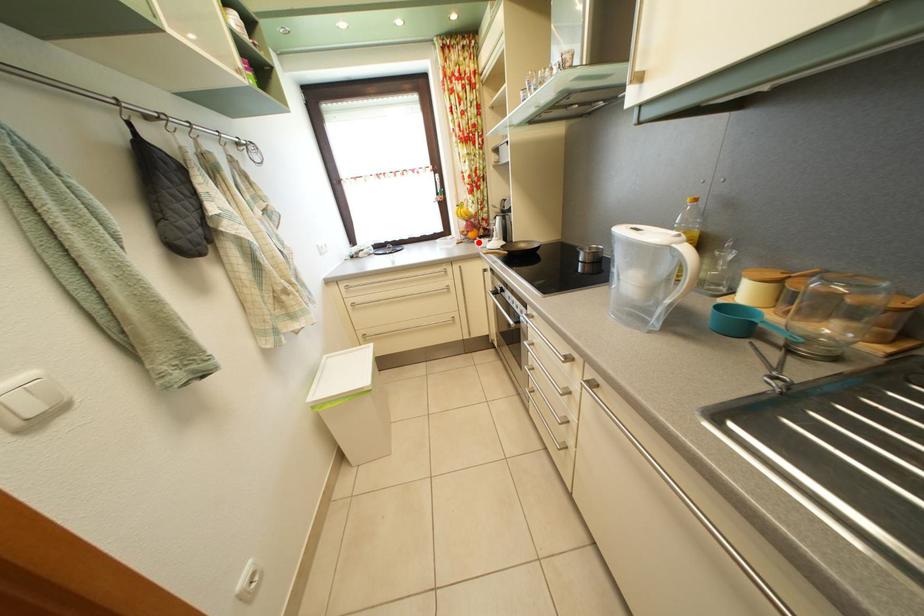
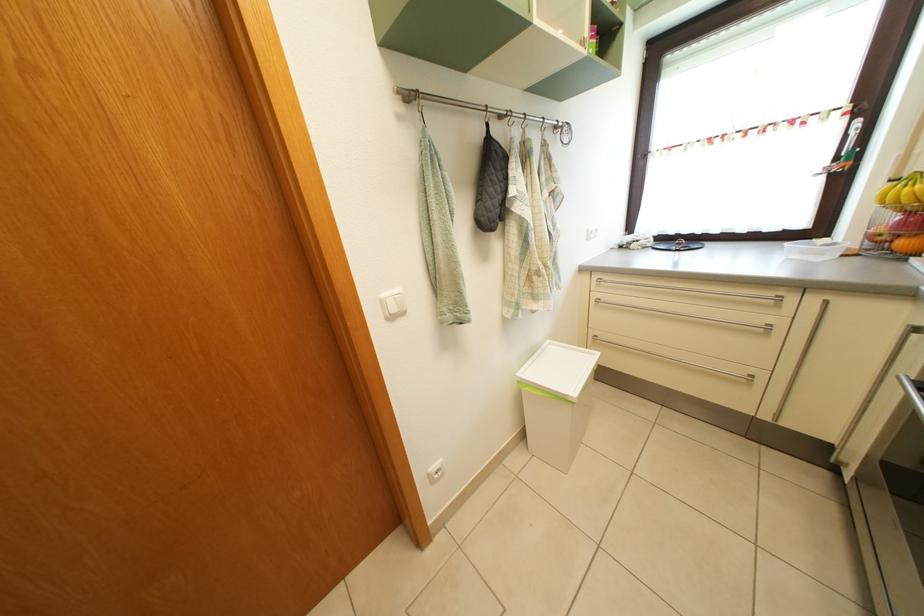
Where in the second image is the point corresponding to the highlighted location from the first image?

(910, 252)